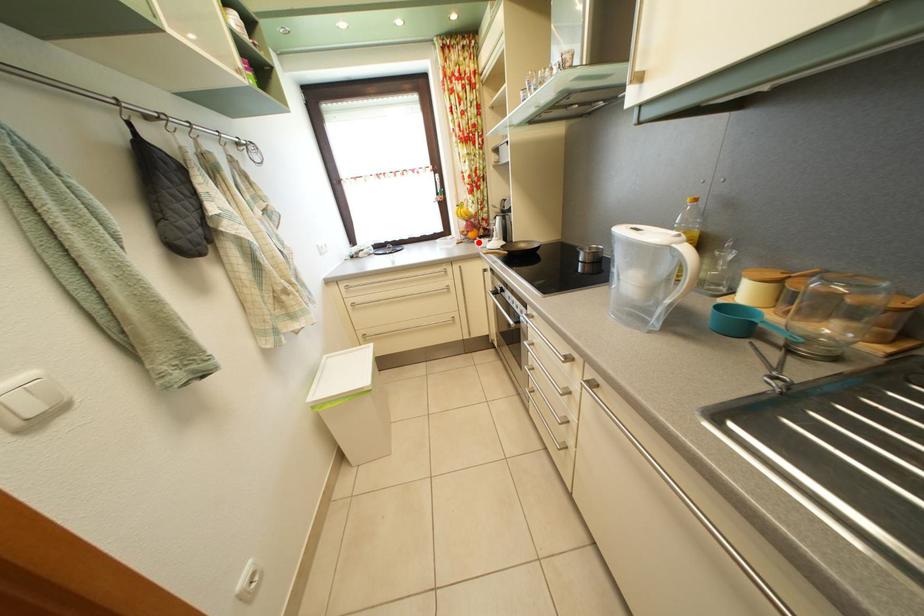
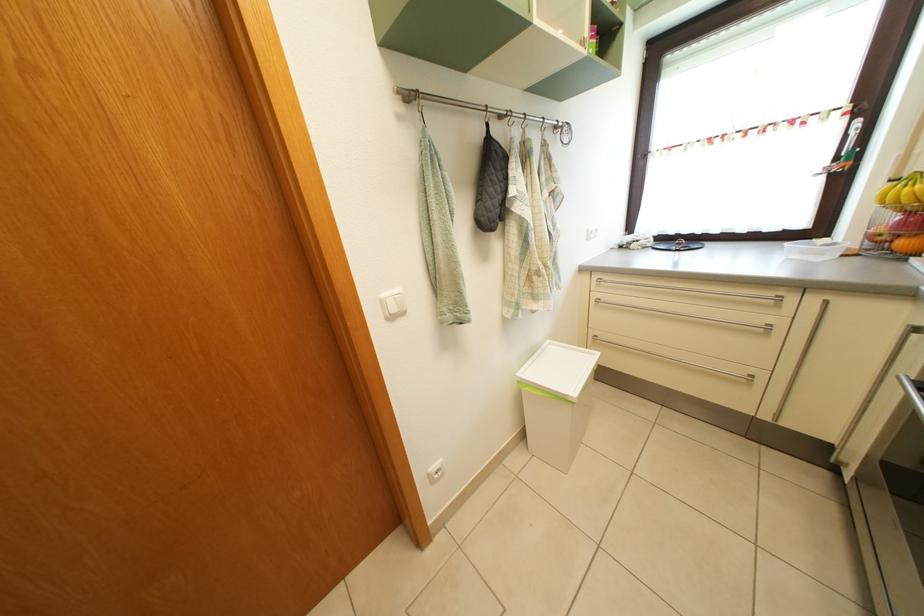
Where in the second image is the point corresponding to the highlighted location from the first image?

(910, 252)